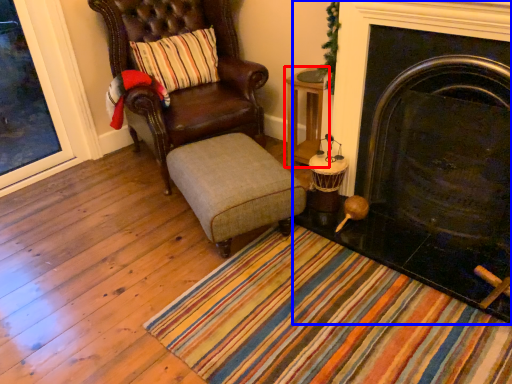
Question: Which object is further to the camera taking this photo, table (highlighted by a red box) or fireplace (highlighted by a blue box)?

Choices:
 (A) table
 (B) fireplace

Answer: (A)